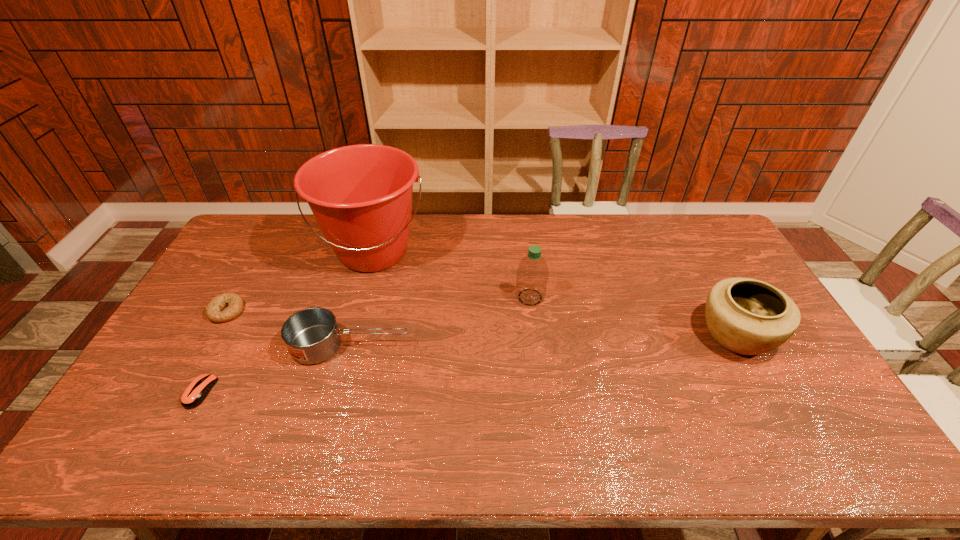
At what (x,y) coordinates should I click in order to perform the action: click on bucket. Please return your answer as a coordinate pair (x, y). Image resolution: width=960 pixels, height=540 pixels. Looking at the image, I should click on (361, 195).

Where is `the second tallest object`? the second tallest object is located at coordinates (532, 273).

In order to click on water bottle in this screenshot , I will do `click(532, 273)`.

At what (x,y) coordinates should I click in order to perform the action: click on pottery. Please return your answer as a coordinate pair (x, y). Looking at the image, I should click on (746, 316).

At what (x,y) coordinates should I click in order to perform the action: click on the third tallest object. Please return your answer as a coordinate pair (x, y). The height and width of the screenshot is (540, 960). Looking at the image, I should click on (746, 316).

I want to click on the third shortest object, so pyautogui.click(x=311, y=335).

This screenshot has height=540, width=960. In order to click on bagel in this screenshot , I will do `click(213, 312)`.

Image resolution: width=960 pixels, height=540 pixels. Identify the location of the shortest object. point(198,389).

Where is `the nearest object`? the nearest object is located at coordinates (198, 389).

What are the coordinates of `blank area located with the handle attached to the rim of the bucket` in the screenshot? It's located at tap(340, 372).